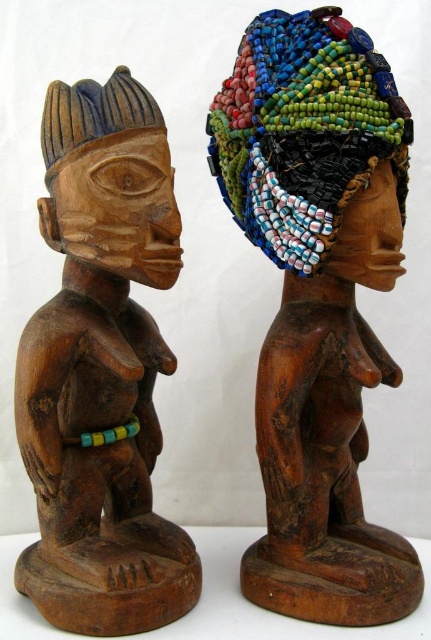
You are an art curator arranging an exhibition. You have two statues displayed side by side on a pedestal. The beaded wood statue at center and the wooden statue at center. A visitor asks which statue is closer to the front. How do you respond?

The wooden statue at center is behind the beaded wood statue at center, so the beaded wood statue at center is closer to the front.

You are an art curator arranging an exhibition. You need to place a label next to each sculpture. The label for the beaded wood statue at center must be placed above it, and the label for the wooden carving at left must be placed below it. Is this arrangement possible given their positions?

The beaded wood statue at center is below the wooden carving at left, so placing the label for the beaded wood statue at center above it and the label for the wooden carving at left below it would require the labels to be placed in opposite positions relative to their respective sculptures. This arrangement is not possible because the wooden carving at left is above the beaded wood statue at center.